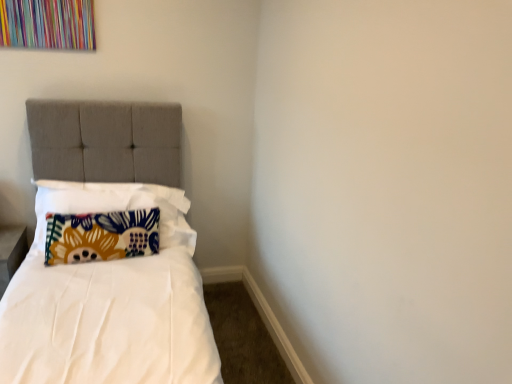
Question: Is floral fabric pillow at left, arranged as the 1th pillow when viewed from the back, to the left or to the right of floral fabric pillow at left, which is counted as the 1th pillow, starting from the front, in the image?

Choices:
 (A) left
 (B) right

Answer: (A)

Question: From a real-world perspective, is floral fabric pillow at left, the 2th pillow from the front, physically located above or below floral fabric pillow at left, which is counted as the 1th pillow, starting from the front?

Choices:
 (A) below
 (B) above

Answer: (A)

Question: Is point (138, 246) closer or farther from the camera than point (181, 241)?

Choices:
 (A) farther
 (B) closer

Answer: (B)

Question: Considering the positions of floral fabric pillow at left, arranged as the 2th pillow when viewed from the back, and floral fabric pillow at left, arranged as the 1th pillow when viewed from the back, in the image, is floral fabric pillow at left, arranged as the 2th pillow when viewed from the back, taller or shorter than floral fabric pillow at left, arranged as the 1th pillow when viewed from the back,?

Choices:
 (A) tall
 (B) short

Answer: (A)

Question: From a real-world perspective, is floral fabric pillow at left, arranged as the 2th pillow when viewed from the back, above or below floral fabric pillow at left, the 2th pillow from the front?

Choices:
 (A) below
 (B) above

Answer: (B)

Question: Looking at their shapes, would you say floral fabric pillow at left, arranged as the 2th pillow when viewed from the back, is wider or thinner than floral fabric pillow at left, the 2th pillow from the front?

Choices:
 (A) thin
 (B) wide

Answer: (B)

Question: From the image's perspective, relative to floral fabric pillow at left, arranged as the 1th pillow when viewed from the back, is floral fabric pillow at left, which is counted as the 1th pillow, starting from the front, above or below?

Choices:
 (A) below
 (B) above

Answer: (B)